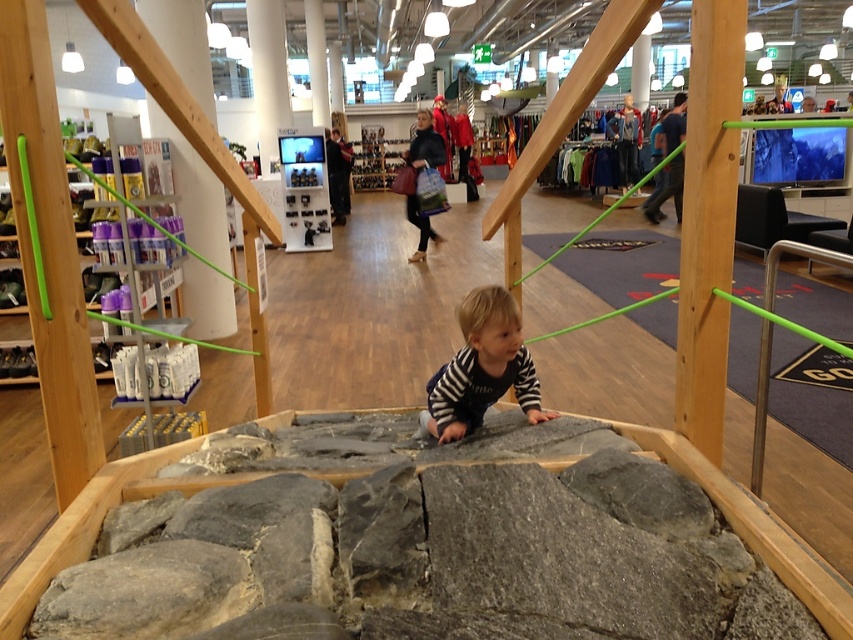
You are a parent trying to ensure your child stays safe while playing in the store. The wooden pole at right and the metallic silver toy at upper center are in the play area. Which object is closer to the ground?

The wooden pole at right is closer to the ground since it is positioned below the metallic silver toy at upper center.

You are a store manager checking the layout of the retail store. You need to place a new display stand that is 1 meter wide between the wooden pole at right and the striped cotton shirt at center. Can the display stand fit between them based on their widths?

The wooden pole at right is wider than the striped cotton shirt at center. Since the display stand is 1 meter wide, but the exact widths of the objects aren not provided, it is impossible to determine if the display stand can fit between them based solely on their relative widths.